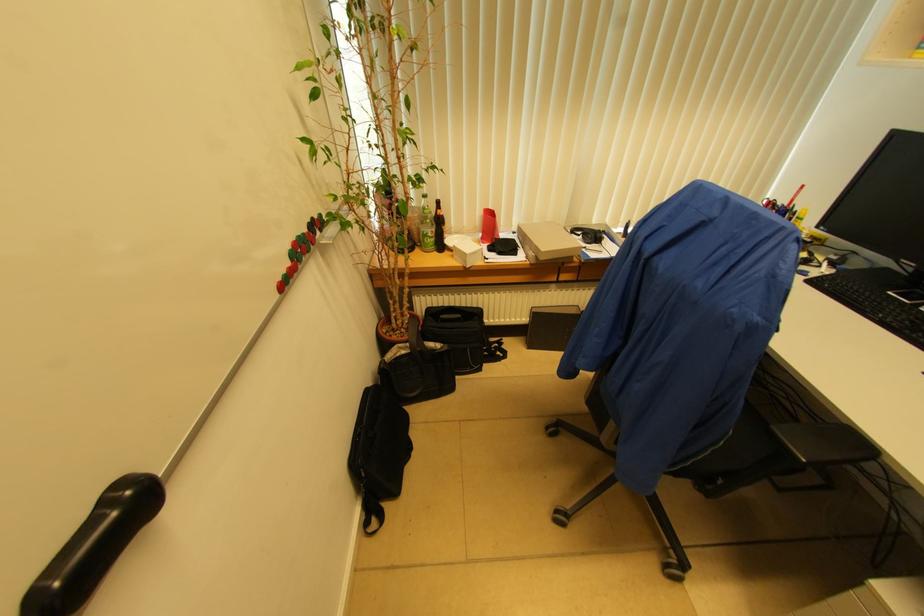
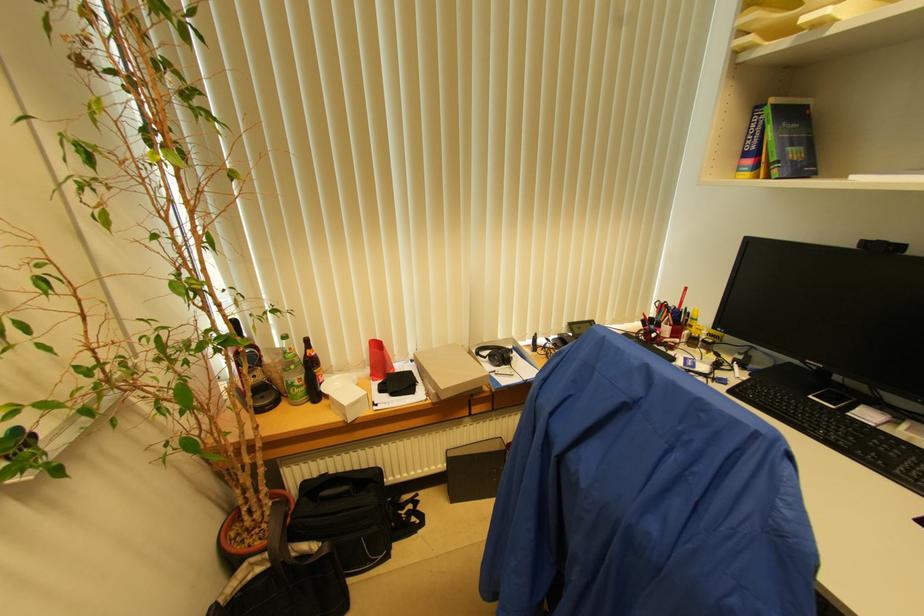
The point at (411, 350) is marked in the first image. Where is the corresponding point in the second image?

(273, 561)